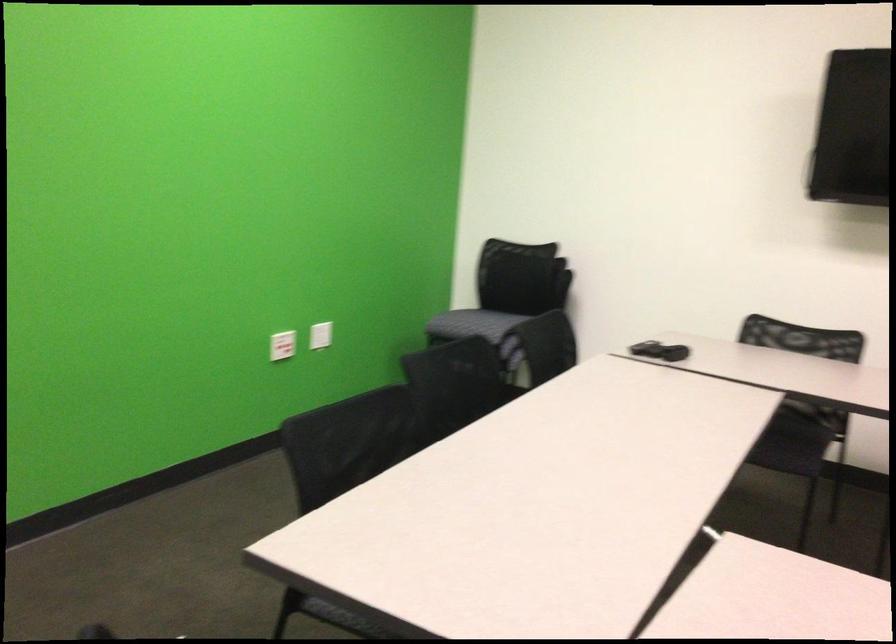
You are a GUI agent. You are given a task and a screenshot of the screen. Output one action in this format:
    pyautogui.click(x=<x>, y=<y>)
    Task: Click on the white light switch
    The width and height of the screenshot is (896, 644).
    Given the screenshot: What is the action you would take?
    pyautogui.click(x=281, y=345)